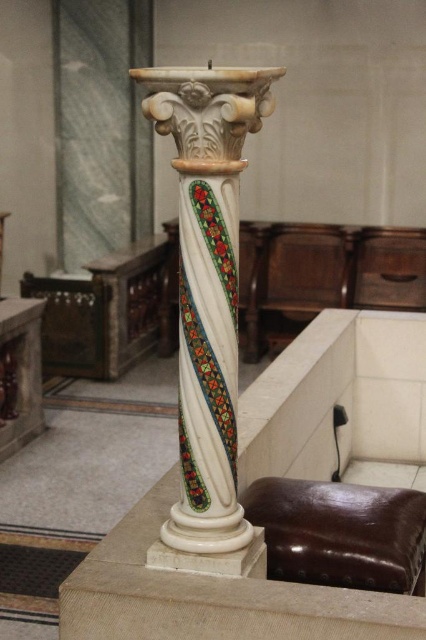
Is white marble column at center to the right of brown leather stool at lower center from the viewer's perspective?

In fact, white marble column at center is to the left of brown leather stool at lower center.

Does white marble column at center have a greater width compared to brown leather stool at lower center?

In fact, white marble column at center might be narrower than brown leather stool at lower center.

Identify the location of white marble column at center. This screenshot has width=426, height=640. (207, 308).

Where is `white marble column at center`? white marble column at center is located at coordinates (207, 308).